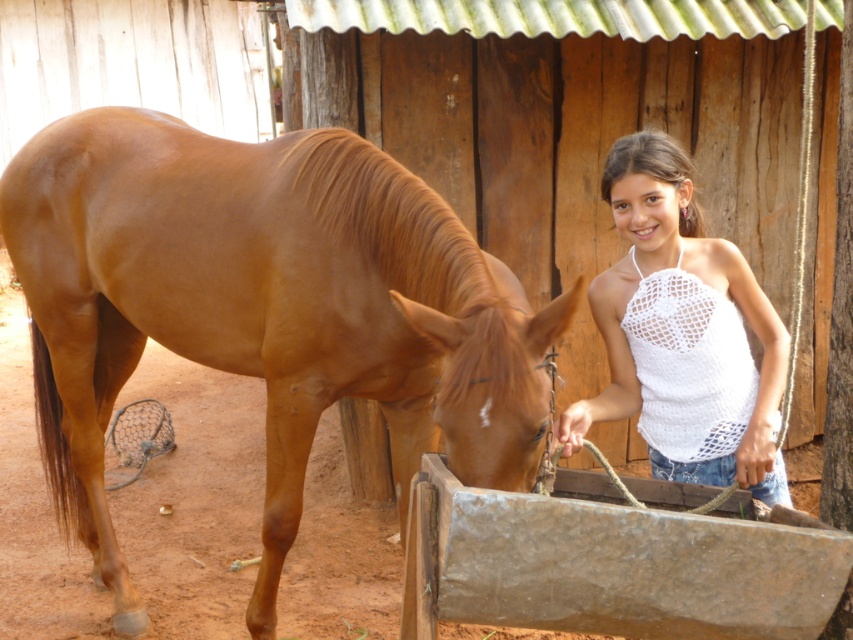
Question: Does brown glossy horse at left lie behind white crochet tank top at center?

Choices:
 (A) yes
 (B) no

Answer: (B)

Question: Which object is closer to the camera taking this photo?

Choices:
 (A) white crochet tank top at center
 (B) brown glossy horse at left

Answer: (B)

Question: Does brown glossy horse at left have a smaller size compared to white crochet tank top at center?

Choices:
 (A) no
 (B) yes

Answer: (A)

Question: Can you confirm if brown glossy horse at left is wider than white crochet tank top at center?

Choices:
 (A) no
 (B) yes

Answer: (B)

Question: Which of the following is the closest to the observer?

Choices:
 (A) white crochet tank top at center
 (B) brown glossy horse at left

Answer: (B)

Question: Among these objects, which one is nearest to the camera?

Choices:
 (A) white crochet tank top at center
 (B) brown glossy horse at left

Answer: (B)